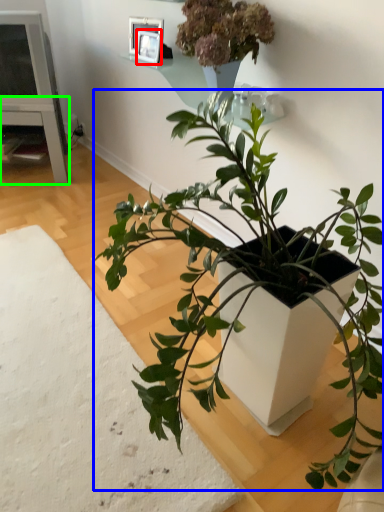
Question: Based on their relative distances, which object is farther from picture frame (highlighted by a red box)? Choose from houseplant (highlighted by a blue box) and table (highlighted by a green box).

Choices:
 (A) houseplant
 (B) table

Answer: (A)